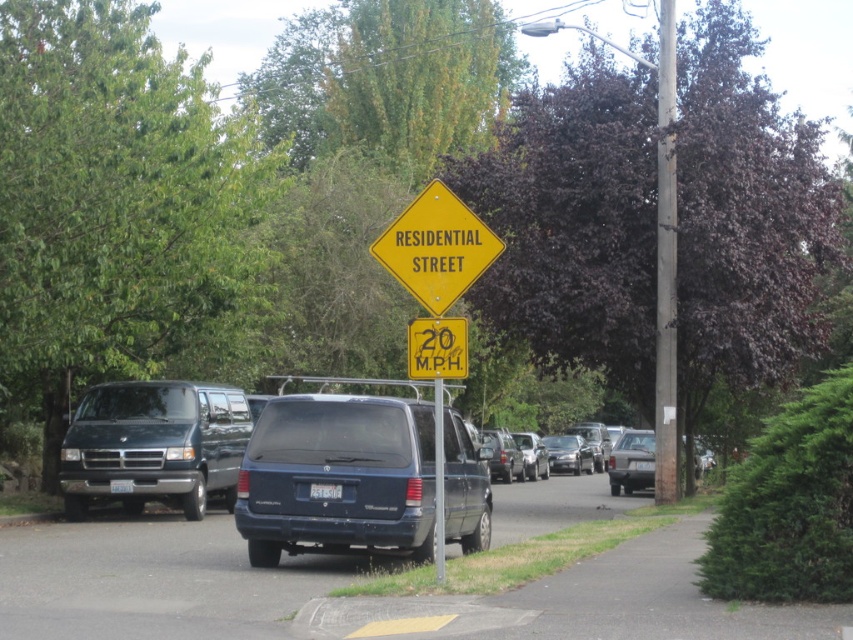
Question: Which object is positioned closest to the matte blue suv at center?

Choices:
 (A) matte black van at left
 (B) metallic gray pole at right
 (C) yellow plastic speed limit sign at center
 (D) brushed metal pole at center

Answer: (D)

Question: Based on their relative distances, which object is farther from the silver metallic sedan at center?

Choices:
 (A) matte blue suv at center
 (B) metallic gray pole at right
 (C) yellow diamond-shaped sign at center
 (D) matte black suv at center

Answer: (C)

Question: Does yellow plastic speed limit sign at center have a greater width compared to brushed metal pole at center?

Choices:
 (A) yes
 (B) no

Answer: (A)

Question: Is brushed metal pole at center to the right of satin silver sedan at center from the viewer's perspective?

Choices:
 (A) no
 (B) yes

Answer: (A)

Question: Among these points, which one is farthest from the camera?

Choices:
 (A) 572,460
 (B) 437,513

Answer: (A)

Question: Does yellow plastic speed limit sign at center have a lesser width compared to silver metallic sedan at center?

Choices:
 (A) no
 (B) yes

Answer: (B)